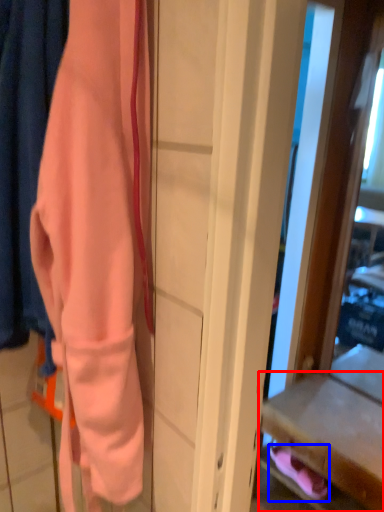
Question: Which point is further to the camera, drawer (highlighted by a red box) or footwear (highlighted by a blue box)?

Choices:
 (A) drawer
 (B) footwear

Answer: (B)